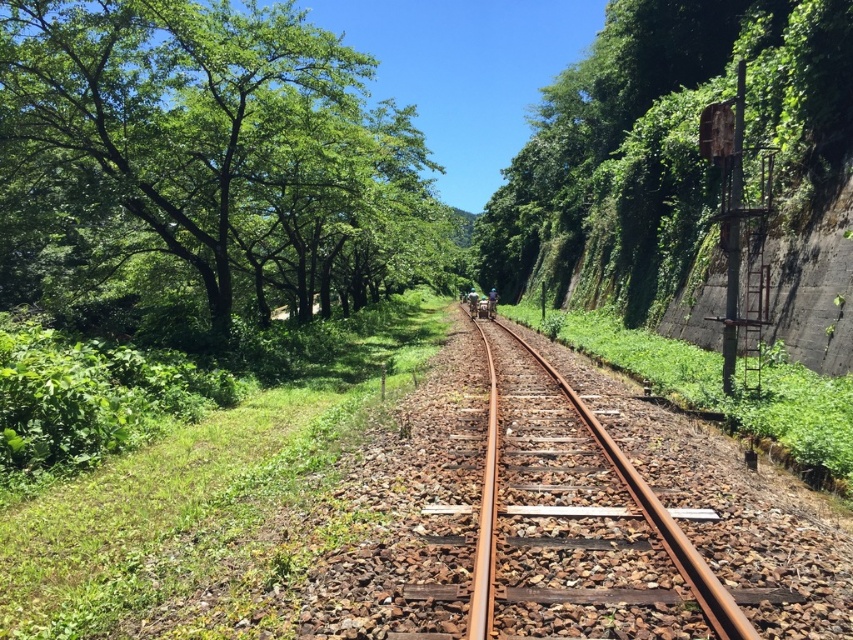
I want to click on green leafy tree at right, so click(662, 138).

Is point (515, 234) closer to camera compared to point (723, 625)?

No, (515, 234) is further to viewer.

Between point (659, 48) and point (671, 518), which one is positioned behind?

Positioned behind is point (659, 48).

Find the location of `green leafy tree at right`. green leafy tree at right is located at coordinates (662, 138).

Does green leafy trees at upper left appear on the right side of green leafy tree at right?

Incorrect, green leafy trees at upper left is not on the right side of green leafy tree at right.

The image size is (853, 640). What do you see at coordinates (223, 147) in the screenshot?
I see `green leafy trees at upper left` at bounding box center [223, 147].

Where is `green leafy trees at upper left`? green leafy trees at upper left is located at coordinates (223, 147).

Does green leafy trees at upper left have a greater height compared to rusty metal train track at center?

Yes, green leafy trees at upper left is taller than rusty metal train track at center.

Is green leafy trees at upper left further to the viewer compared to rusty metal train track at center?

Yes, green leafy trees at upper left is behind rusty metal train track at center.

You are a GUI agent. You are given a task and a screenshot of the screen. Output one action in this format:
    pyautogui.click(x=<x>, y=<y>)
    Task: Click on the green leafy trees at upper left
    
    Given the screenshot: What is the action you would take?
    pyautogui.click(x=223, y=147)